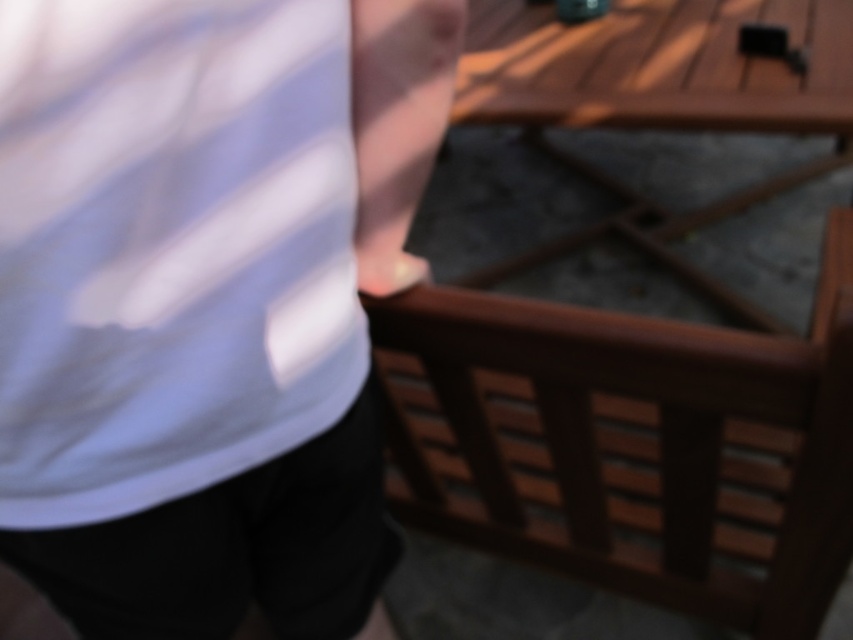
Between white matte shirt at upper left and black cotton shorts at lower left, which one appears on the right side from the viewer's perspective?

From the viewer's perspective, white matte shirt at upper left appears more on the right side.

At what (x,y) coordinates should I click in order to perform the action: click on white matte shirt at upper left. Please return your answer as a coordinate pair (x, y). Looking at the image, I should click on (206, 300).

Which of these two, wooden picnic table at center or black cotton shorts at lower left, stands shorter?

black cotton shorts at lower left

Who is positioned more to the right, wooden picnic table at center or black cotton shorts at lower left?

Positioned to the right is wooden picnic table at center.

Does point (833, 60) come behind point (357, 433)?

Yes, point (833, 60) is behind point (357, 433).

Locate an element on the screen. wooden picnic table at center is located at coordinates (659, 102).

The height and width of the screenshot is (640, 853). Describe the element at coordinates (631, 442) in the screenshot. I see `brown wooden balustrade at right` at that location.

Does brown wooden balustrade at right come in front of wooden picnic table at center?

Yes, it is.

Where is `brown wooden balustrade at right`? brown wooden balustrade at right is located at coordinates [x=631, y=442].